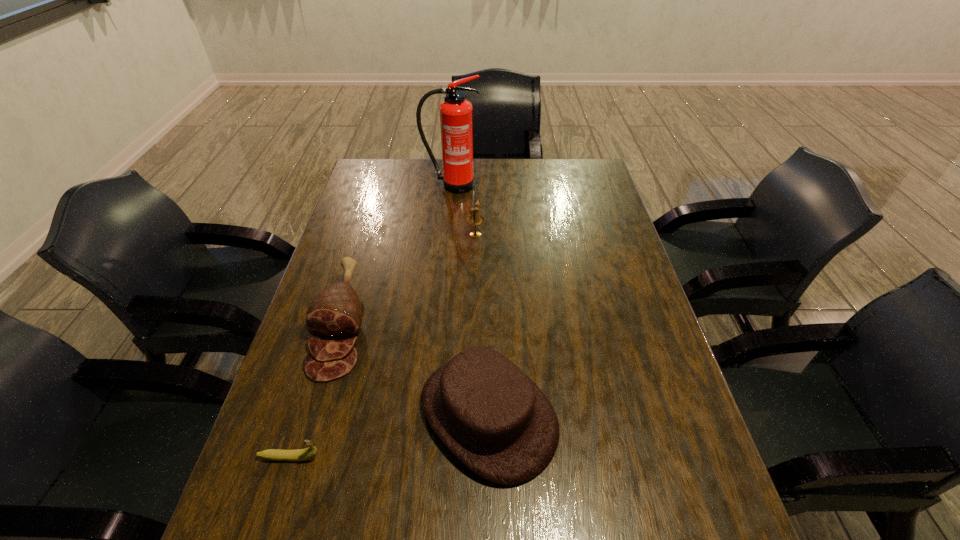
The image size is (960, 540). Identify the location of vacant area between the tallest object and the hat. (469, 300).

This screenshot has height=540, width=960. I want to click on free space between the hat and the tallest object, so click(x=469, y=300).

In order to click on free space between the hat and the farthest object in this screenshot , I will do `click(469, 300)`.

At what (x,y) coordinates should I click in order to perform the action: click on unoccupied position between the ham and the fire extinguisher. Please return your answer as a coordinate pair (x, y). Image resolution: width=960 pixels, height=540 pixels. Looking at the image, I should click on (396, 255).

This screenshot has width=960, height=540. Find the location of `unoccupied area between the candle holder and the shortest object`. unoccupied area between the candle holder and the shortest object is located at coordinates (383, 346).

Point out which object is positioned as the nearest to the banana. Please provide its 2D coordinates. Your answer should be formatted as a tuple, i.e. [(x, y)], where the tuple contains the x and y coordinates of a point satisfying the conditions above.

[(336, 313)]

You are a GUI agent. You are given a task and a screenshot of the screen. Output one action in this format:
    pyautogui.click(x=<x>, y=<y>)
    Task: Click on the object that is the closest to the shortest object
    
    Given the screenshot: What is the action you would take?
    pyautogui.click(x=336, y=313)

Where is `blank area in the image that satisfies the following two spatial constraints: 1. at the sliced end of the hat; 2. on the right side of the ham`? This screenshot has height=540, width=960. blank area in the image that satisfies the following two spatial constraints: 1. at the sliced end of the hat; 2. on the right side of the ham is located at coordinates coord(315,414).

At what (x,y) coordinates should I click in order to perform the action: click on free spot that satisfies the following two spatial constraints: 1. at the nozzle of the tallest object; 2. on the right side of the hat. Please return your answer as a coordinate pair (x, y). The height and width of the screenshot is (540, 960). Looking at the image, I should click on (432, 414).

Locate an element on the screen. free region that satisfies the following two spatial constraints: 1. at the nozzle of the tallest object; 2. at the stem of the banana is located at coordinates (428, 457).